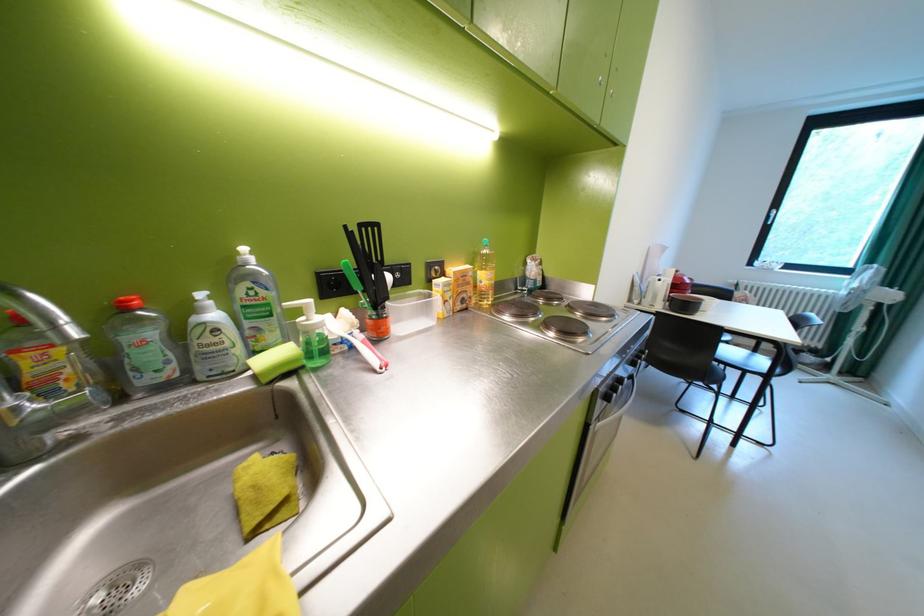
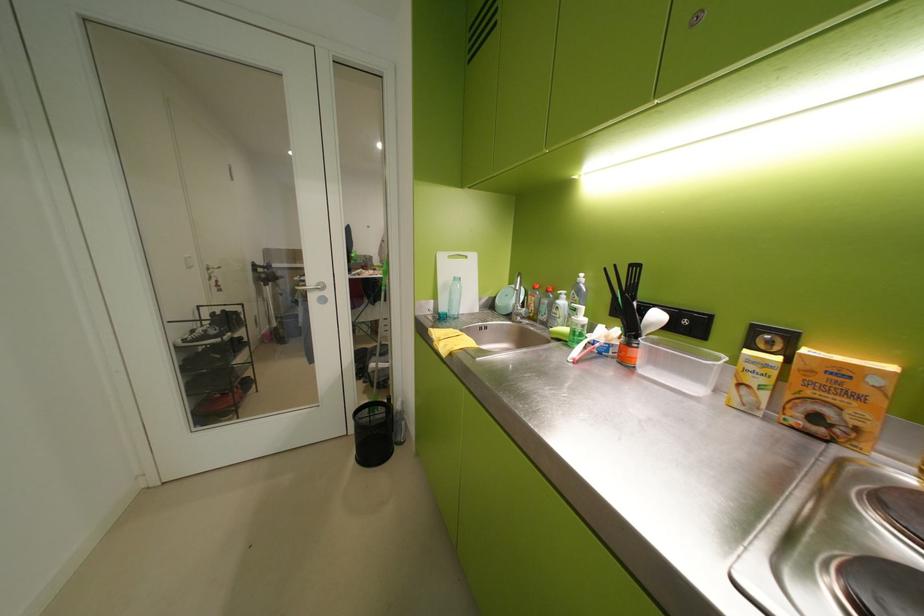
The point at (440, 265) is marked in the first image. Where is the corresponding point in the second image?

(767, 331)